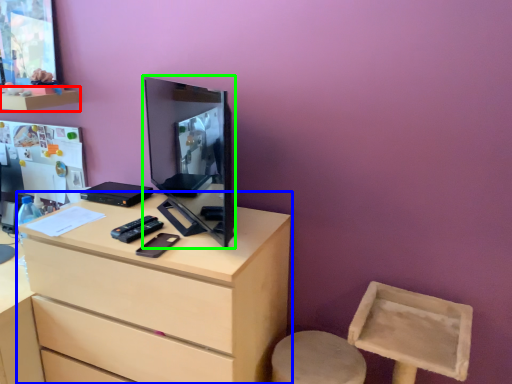
Question: Estimate the real-world distances between objects in this image. Which object is closer to shelf (highlighted by a red box), chest of drawers (highlighted by a blue box) or computer monitor (highlighted by a green box)?

Choices:
 (A) chest of drawers
 (B) computer monitor

Answer: (B)